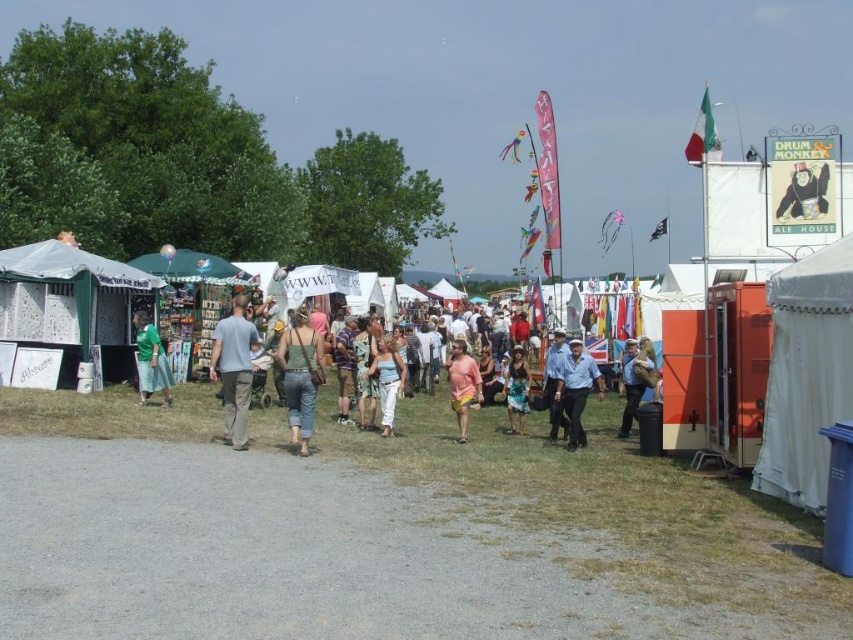
You are at an outdoor fair and notice two items on a vendor table. The items are the green fabric skirt at left and the brown leather jacket at center. Which item is placed higher up on the table?

The green fabric skirt at left is positioned over the brown leather jacket at center, so it is placed higher up on the table.

Looking at this image, you are a photographer at the fair and want to capture both the green fabric skirt at left and the brown leather jacket at center in your photo. Which object should you focus on first to ensure both are in frame?

The green fabric skirt at left is shorter than the brown leather jacket at center. To include both in the frame, focus on the brown leather jacket at center first since it is taller and adjust the camera angle accordingly.